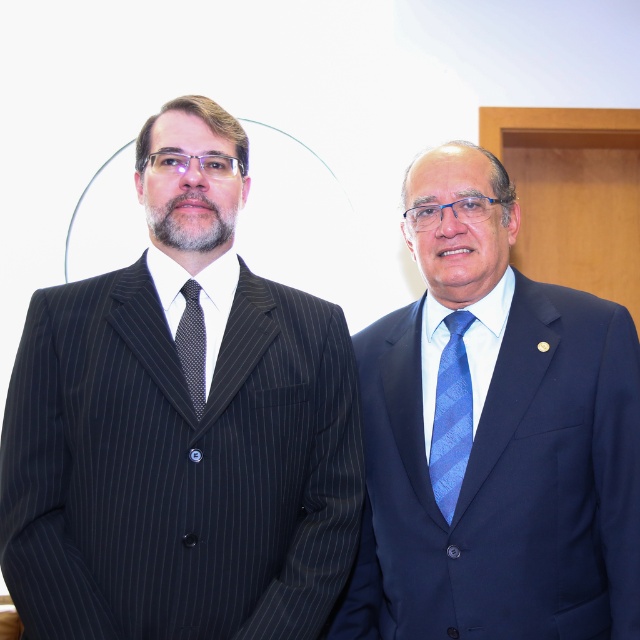
You are a tailor who needs to determine which item requires more fabric between the blue satin suit at right and the blue textured tie at right. Based on their sizes, which one would need more fabric?

The blue satin suit at right has a larger size compared to the blue textured tie at right, so it would require more fabric.

You are a photographer setting up a shoot. You need to position a light source so that it illuminates both the blue satin suit at right and the black dotted fabric tie at left. Based on their positions, which object should be placed closer to the light source to ensure even illumination?

The blue satin suit at right is located below the black dotted fabric tie at left. To ensure even illumination, the blue satin suit at right should be placed closer to the light source since it is lower and might require more light to achieve the same brightness as the higher positioned tie.

You are a fashion designer observing two formal outfits in the image. The pinstriped suit at left and the black dotted fabric tie at left are part of the same outfit. Can you determine which item is taller?

The pinstriped suit at left has a greater height compared to the black dotted fabric tie at left, so the pinstriped suit at left is taller.